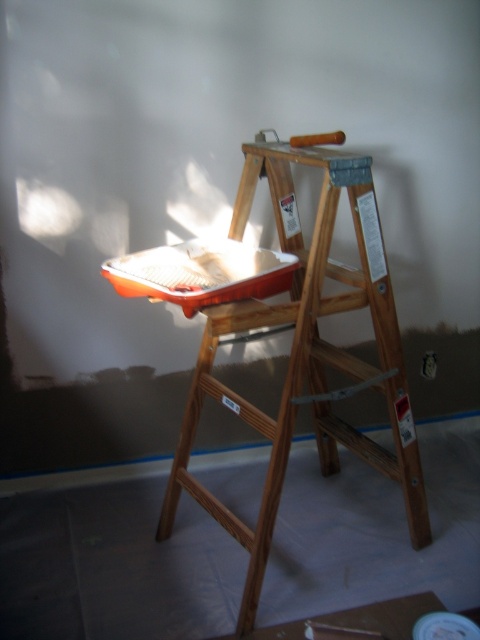
Does point (212, 502) lie behind point (192, 268)?

Yes, it is behind point (192, 268).

What do you see at coordinates (305, 348) in the screenshot?
I see `wooden ladder at center` at bounding box center [305, 348].

Identify the location of wooden ladder at center. (305, 348).